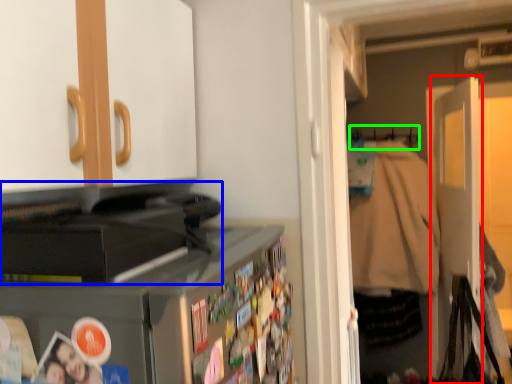
Question: Which is nearer to the door (highlighted by a red box)? appliance (highlighted by a blue box) or hanger (highlighted by a green box).

Choices:
 (A) appliance
 (B) hanger

Answer: (B)